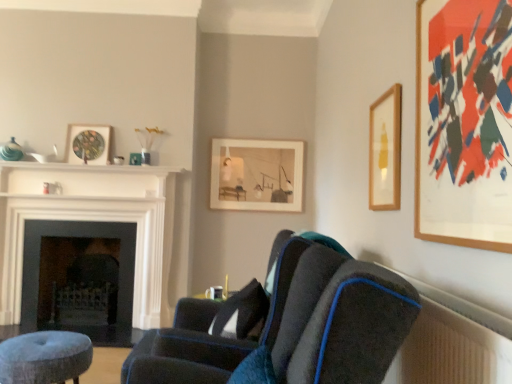
Find the location of a particular element. The height and width of the screenshot is (384, 512). vacant space underneath wooden framed artwork at upper right, the fourth picture frame from the back (from a real-world perspective) is located at coordinates (454, 292).